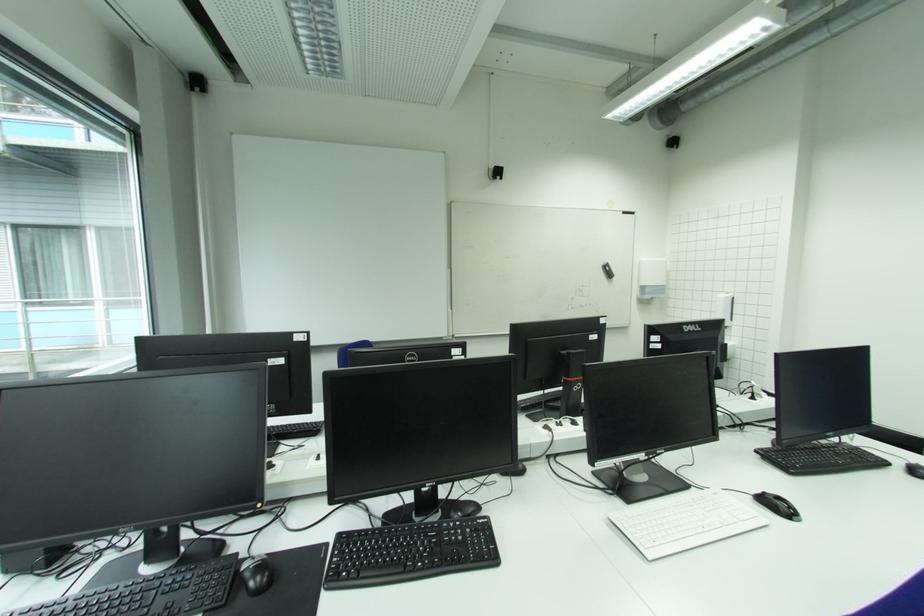
What are the coordinates of `white keyboard` in the screenshot? It's located at (685, 522).